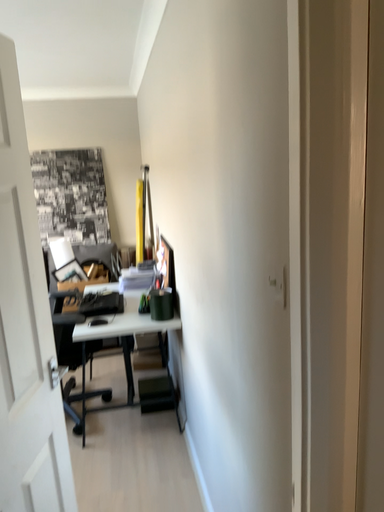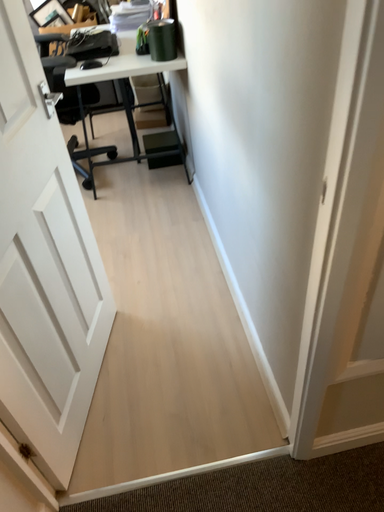
Question: How did the camera likely rotate when shooting the video?

Choices:
 (A) rotated upward
 (B) rotated downward

Answer: (B)